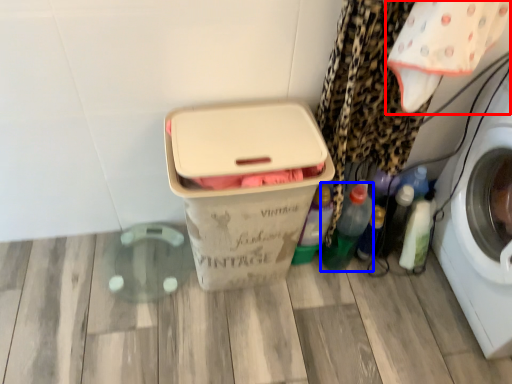
Question: Which object is further to the camera taking this photo, baby clothe (highlighted by a red box) or bottle (highlighted by a blue box)?

Choices:
 (A) baby clothe
 (B) bottle

Answer: (B)